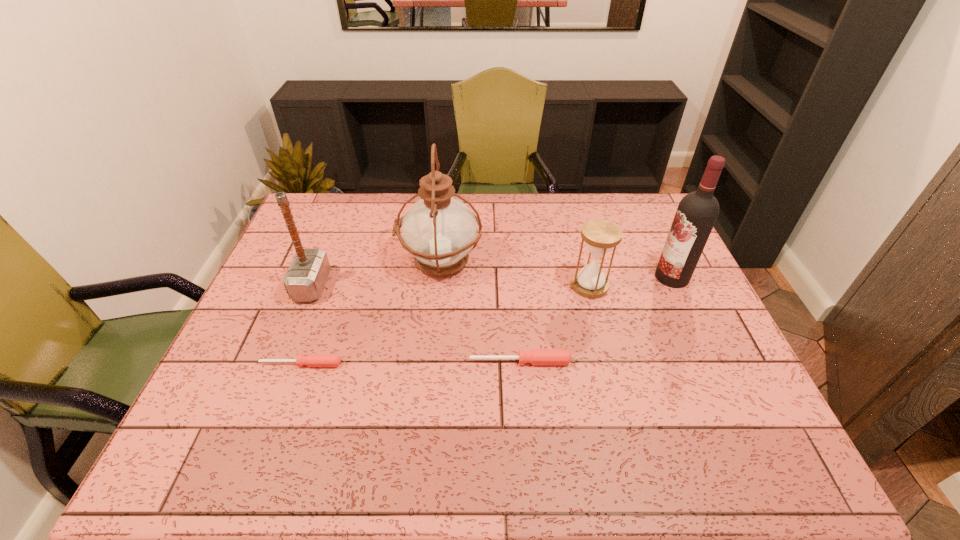
Where is `vacant region located 0.390m on the left of the taller screwdriver`? This screenshot has height=540, width=960. vacant region located 0.390m on the left of the taller screwdriver is located at coordinates (313, 362).

Locate an element on the screen. free location located on the front of the oil lamp is located at coordinates (431, 355).

Locate an element on the screen. The image size is (960, 540). free space located on the striking surface of the fourth shortest object is located at coordinates (395, 286).

The width and height of the screenshot is (960, 540). Identify the location of vacant space located 0.360m on the front of the hourglass. (623, 414).

Identify the location of vacant space located on the label of the rightmost object. Image resolution: width=960 pixels, height=540 pixels. (565, 277).

At what (x,y) coordinates should I click in order to perform the action: click on vacant region located 0.280m on the label of the rightmost object. Please return your answer as a coordinate pair (x, y). This screenshot has width=960, height=540. Looking at the image, I should click on (562, 277).

The height and width of the screenshot is (540, 960). What are the coordinates of `vacant area located on the label of the rightmost object` in the screenshot? It's located at (582, 277).

You are a GUI agent. You are given a task and a screenshot of the screen. Output one action in this format:
    pyautogui.click(x=<x>, y=<y>)
    Task: Click on the screwdriver positioned at the left edge
    The height and width of the screenshot is (540, 960).
    Given the screenshot: What is the action you would take?
    pyautogui.click(x=312, y=360)

Find the location of `hammer that is at the left edge`. hammer that is at the left edge is located at coordinates (305, 279).

Identify the location of object present at the right edge. (697, 212).